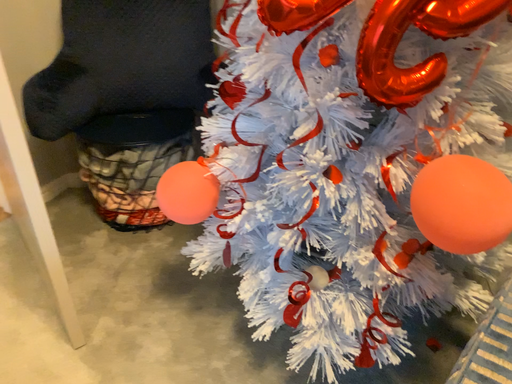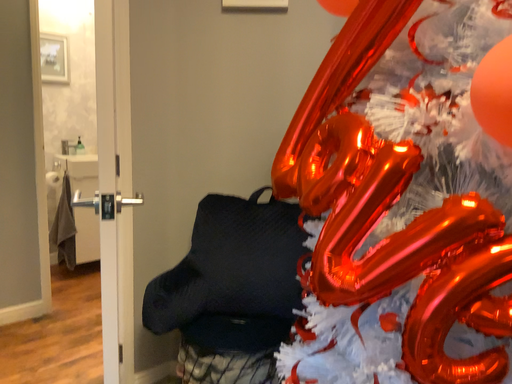
Question: Which way did the camera rotate in the video?

Choices:
 (A) rotated left
 (B) rotated right

Answer: (A)